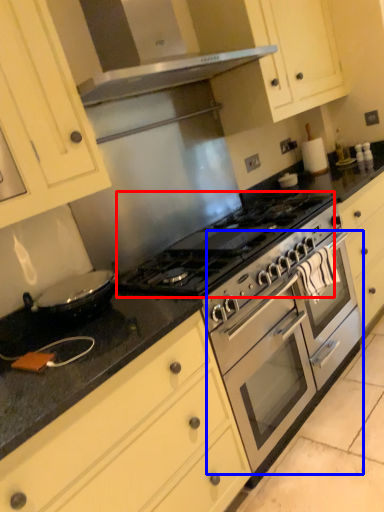
Question: Which object is closer to the camera taking this photo, gas stove (highlighted by a red box) or oven (highlighted by a blue box)?

Choices:
 (A) gas stove
 (B) oven

Answer: (A)